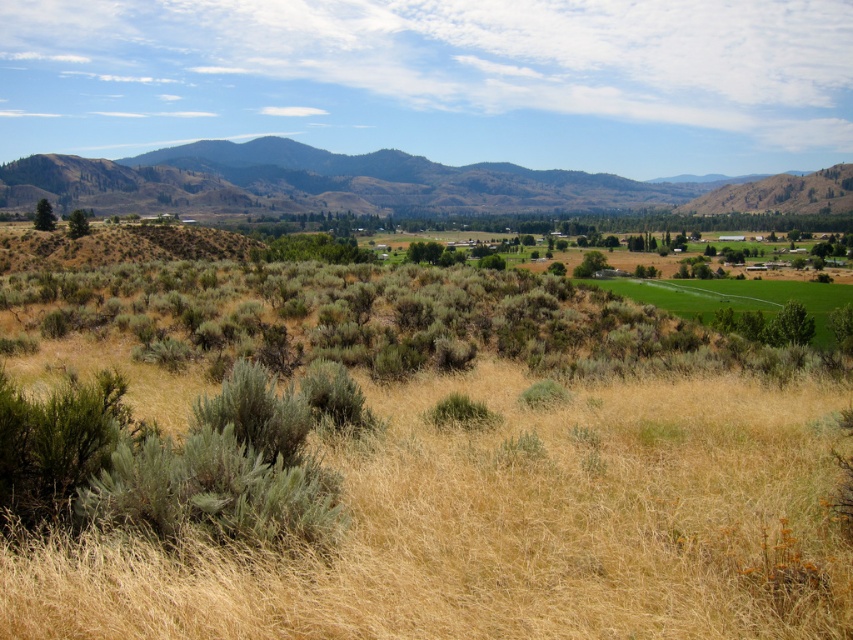
Question: Which of the following is the farthest from the observer?

Choices:
 (A) dry grassland at center
 (B) brown textured mountains at upper left

Answer: (B)

Question: Which object is farther from the camera taking this photo?

Choices:
 (A) brown textured mountains at upper left
 (B) dry grassland at center

Answer: (A)

Question: Can you confirm if dry grassland at center is thinner than brown textured mountains at upper left?

Choices:
 (A) yes
 (B) no

Answer: (A)

Question: Is dry grassland at center thinner than brown textured mountains at upper left?

Choices:
 (A) no
 (B) yes

Answer: (B)

Question: Does dry grassland at center have a greater width compared to brown textured mountains at upper left?

Choices:
 (A) yes
 (B) no

Answer: (B)